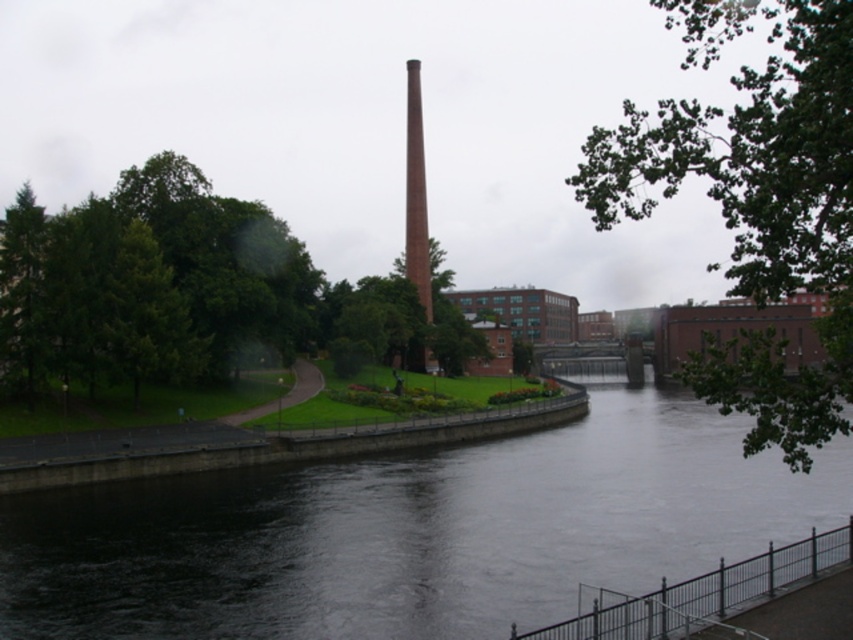
Question: In this image, where is green leafy tree at center located relative to red brick chimney at center?

Choices:
 (A) above
 (B) below

Answer: (B)

Question: Which point is farther to the camera?

Choices:
 (A) (9, 552)
 (B) (412, 132)
 (C) (848, 180)
 (D) (202, 244)

Answer: (B)

Question: Is dark gray concrete river at center thinner than green leafy tree at center?

Choices:
 (A) yes
 (B) no

Answer: (B)

Question: Which point is farther to the camera?

Choices:
 (A) (422, 163)
 (B) (270, 317)
 (C) (451, 611)

Answer: (A)

Question: Which of the following is the farthest from the observer?

Choices:
 (A) (378, 477)
 (B) (843, 397)

Answer: (A)

Question: Can you confirm if green leafy tree at center is wider than red brick chimney at center?

Choices:
 (A) yes
 (B) no

Answer: (A)